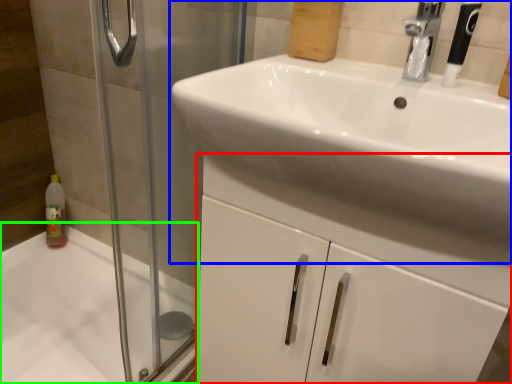
Question: Which object is the farthest from bathroom cabinet (highlighted by a red box)? Choose among these: sink (highlighted by a blue box) or bath (highlighted by a green box).

Choices:
 (A) sink
 (B) bath

Answer: (B)